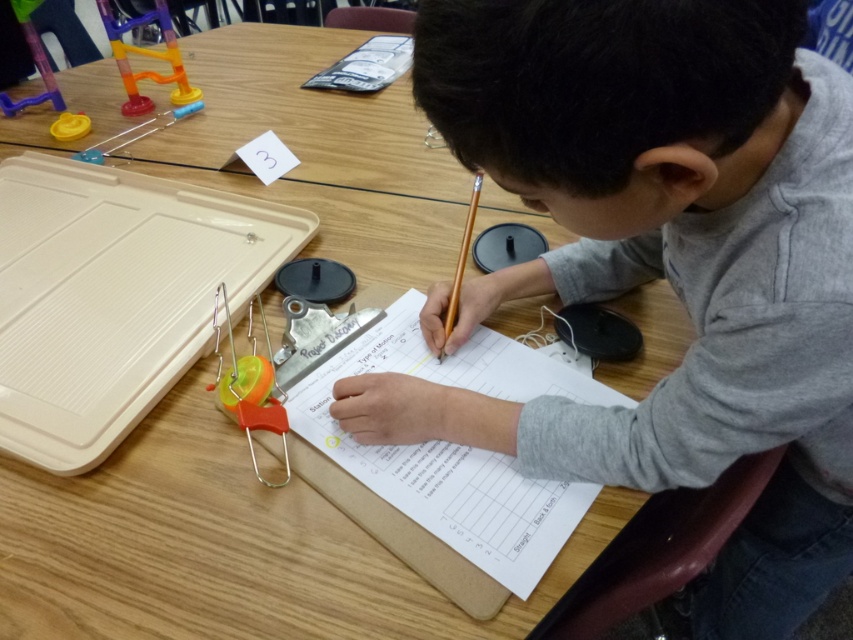
You are a student trying to place your gray cotton shirt at center and white paper at center on a narrow desk. Which item should you place first to ensure both fit side by side?

The gray cotton shirt at center is wider than the white paper at center, so you should place the gray cotton shirt at center first to ensure both items fit side by side on the narrow desk.

What is the 2D coordinate of the gray cotton shirt at center in the image?

The gray cotton shirt at center is located at the 2D coordinate point of (660, 260).

You are a student sitting at the wooden table in the classroom. You need to place a small sticker exactly halfway between the point at coordinates point (714, 266) and point (461, 384). Where should you place the sticker?

The sticker should be placed at the midpoint between point (714, 266) and point (461, 384). To calculate the midpoint, average the x and y coordinates separately. The midpoint x is 0.417 and 0.600 divided by 2 equals 0.5085, and the midpoint y is 0.838 and 0.542 divided by 2 equals 0.690. Therefore, the sticker should be placed at coordinates approximately 0.509, 0.690.